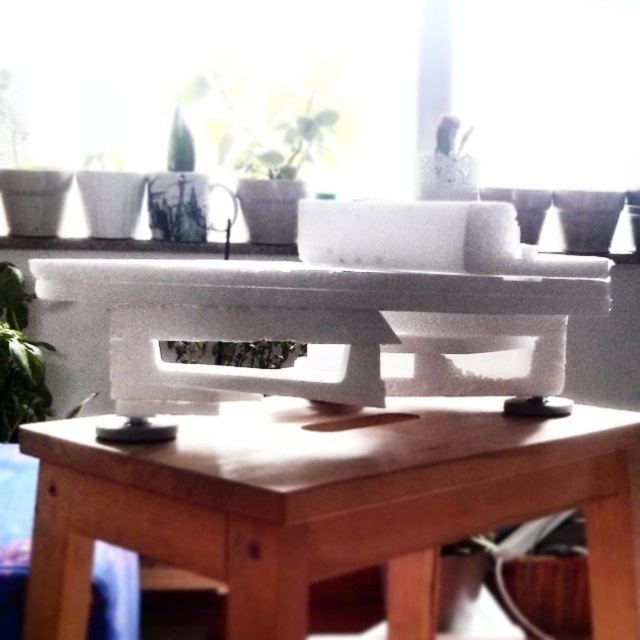
You are a delivery person who needs to place a package that is 1.5 meters long on the floor between the brown wooden table at center and the transparent glass window at upper center. Is there enough space for the package to fit horizontally between these two objects?

The distance between the brown wooden table at center and the transparent glass window at upper center is 1.54 meters. Since the package is 1.5 meters long, it will fit with a small amount of space remaining.

You are a delivery person who just arrived at this home. You need to place a large package on the brown wooden table at center. However, you notice the transparent glass window at upper center. Will placing the package on the table block the view through the window?

The brown wooden table at center is in front of the transparent glass window at upper center. Placing the package on the table will block the view through the window since the table is positioned directly in front of it.

You are arranging a new potted plant in the living room. You want to place it so that it receives sunlight from the transparent glass window at upper center. Where should you place the green matte plant at lower left relative to the window?

The transparent glass window at upper center is positioned over the green matte plant at lower left, so placing the green matte plant at lower left directly under the window would ensure it receives sunlight.